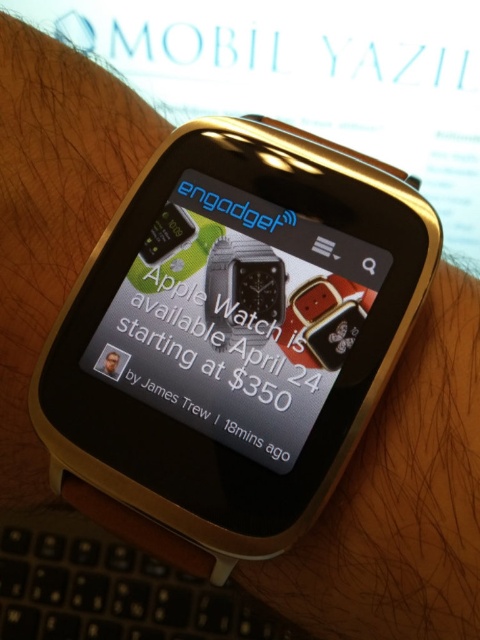
Question: Is gold metallic smartwatch at center behind matte black smartwatch at center?

Choices:
 (A) yes
 (B) no

Answer: (B)

Question: Which point appears closest to the camera in this image?

Choices:
 (A) (236, 332)
 (B) (399, 211)

Answer: (B)

Question: Which is farther from the satin black watch at center?

Choices:
 (A) black plastic keyboard at lower left
 (B) matte black smartwatch at center
 (C) gold metallic smartwatch at center

Answer: (A)

Question: Which point is farther from the camera taking this photo?

Choices:
 (A) (259, 616)
 (B) (216, 321)

Answer: (A)

Question: Is gold metallic smartwatch at center positioned behind matte black smartwatch at center?

Choices:
 (A) yes
 (B) no

Answer: (B)

Question: Where is gold metallic smartwatch at center located in relation to matte black smartwatch at center in the image?

Choices:
 (A) left
 (B) right

Answer: (A)